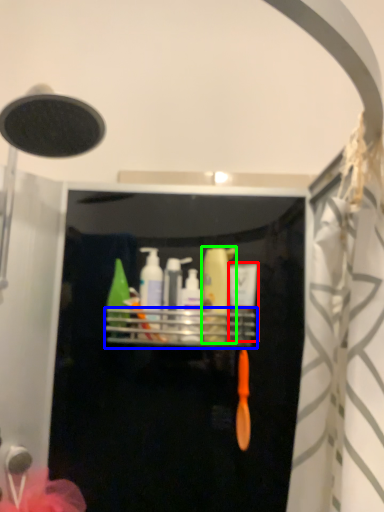
Question: Based on their relative distances, which object is farther from toiletry (highlighted by a red box)? Choose from shelf (highlighted by a blue box) and toiletry (highlighted by a green box).

Choices:
 (A) shelf
 (B) toiletry

Answer: (A)